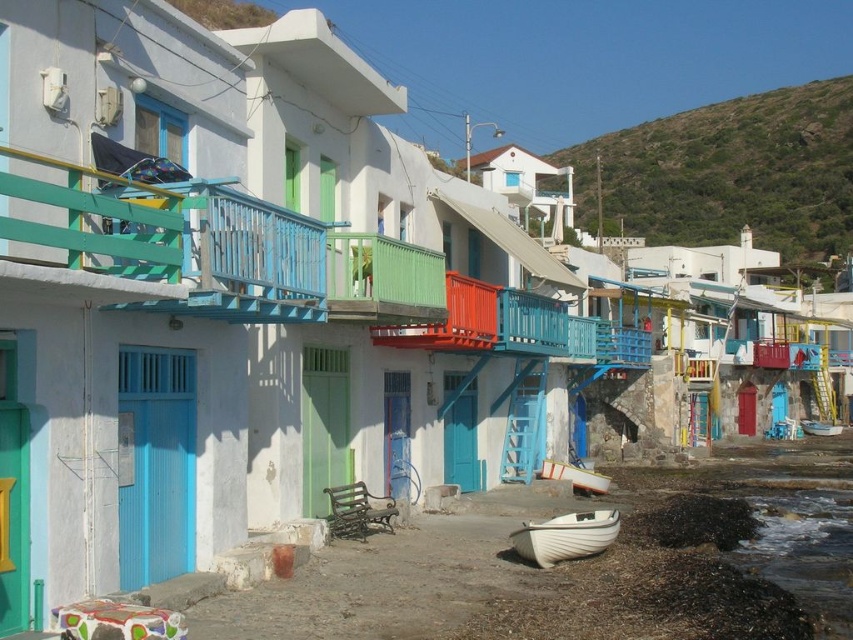
Can you confirm if white matte boat at lower center is shorter than white plastic boat at lower center?

In fact, white matte boat at lower center may be taller than white plastic boat at lower center.

Which is behind, point (560, 516) or point (541, 467)?

The point (541, 467) is behind.

This screenshot has width=853, height=640. In order to click on white matte boat at lower center in this screenshot , I will do `click(566, 536)`.

Does green grassy hillside at upper center have a larger size compared to white plastic boat at lower center?

Yes.

The image size is (853, 640). I want to click on green grassy hillside at upper center, so coord(728,173).

Locate an element on the screen. The height and width of the screenshot is (640, 853). green grassy hillside at upper center is located at coordinates (728, 173).

Where is `green grassy hillside at upper center`? The image size is (853, 640). green grassy hillside at upper center is located at coordinates (728, 173).

Which of these two, white matte boat at lower center or white plastic boat at lower right, stands shorter?

white plastic boat at lower right is shorter.

Between point (535, 547) and point (805, 433), which one is positioned in front?

Point (535, 547) is in front.

Identify the location of white matte boat at lower center. (566, 536).